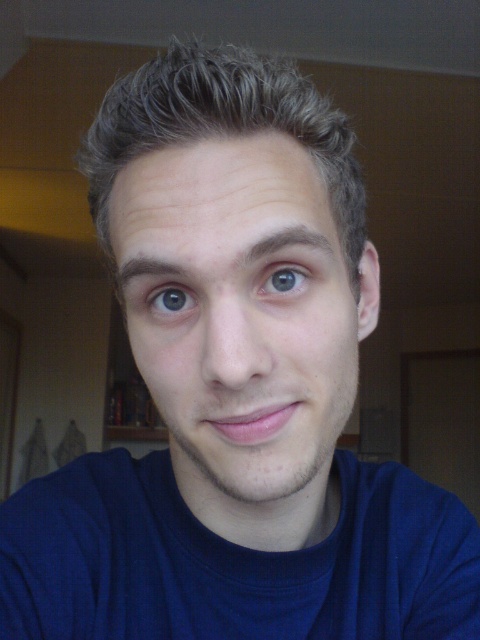
Which is in front, point (230, 432) or point (178, 292)?

Positioned in front is point (230, 432).

Between point (196, 228) and point (182, 310), which one is positioned in front?

Point (196, 228) is more forward.

Where is `smooth skin face at center`? Image resolution: width=480 pixels, height=640 pixels. smooth skin face at center is located at coordinates (240, 316).

Describe the element at coordinates (240, 316) in the screenshot. I see `smooth skin face at center` at that location.

Between smooth skin face at center and light brown textured hair at center, which one is positioned higher?

light brown textured hair at center

Which is in front, point (252, 355) or point (296, 92)?

Point (252, 355)

At what (x,y) coordinates should I click in order to perform the action: click on smooth skin face at center. Please return your answer as a coordinate pair (x, y). Looking at the image, I should click on (240, 316).

Does blue matte eye at center have a lesser width compared to blue glossy eye at center?

Correct, blue matte eye at center's width is less than blue glossy eye at center's.

Does point (278, 273) lie behind point (169, 291)?

No, (278, 273) is closer to viewer.

Is point (303, 276) closer to camera compared to point (187, 304)?

That is True.

Locate an element on the screen. The image size is (480, 640). blue matte eye at center is located at coordinates coord(284,280).